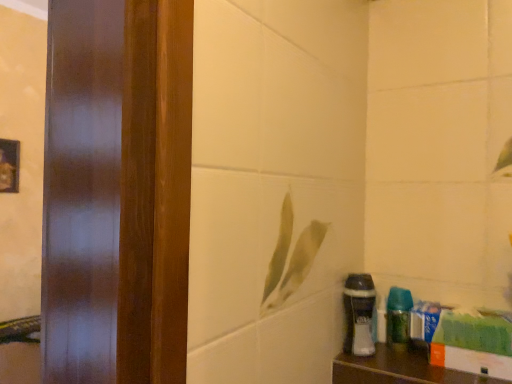
Locate an element on the screen. This screenshot has width=512, height=384. empty space that is ontop of wooden shelf at lower right is located at coordinates (409, 363).